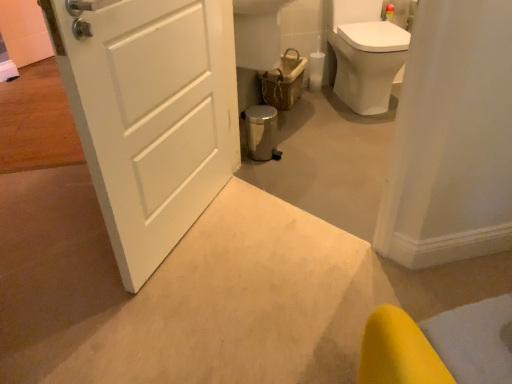
Question: Is white matte door at center to the left or to the right of woven brown basket at center in the image?

Choices:
 (A) right
 (B) left

Answer: (B)

Question: From a real-world perspective, is white matte door at center above or below woven brown basket at center?

Choices:
 (A) above
 (B) below

Answer: (A)

Question: Considering the real-world distances, which object is closest to the woven brown basket at center?

Choices:
 (A) white glossy toilet at upper right
 (B) white matte door at center

Answer: (A)

Question: Considering the real-world distances, which object is closest to the white glossy toilet at upper right?

Choices:
 (A) white matte door at center
 (B) woven brown basket at center

Answer: (B)